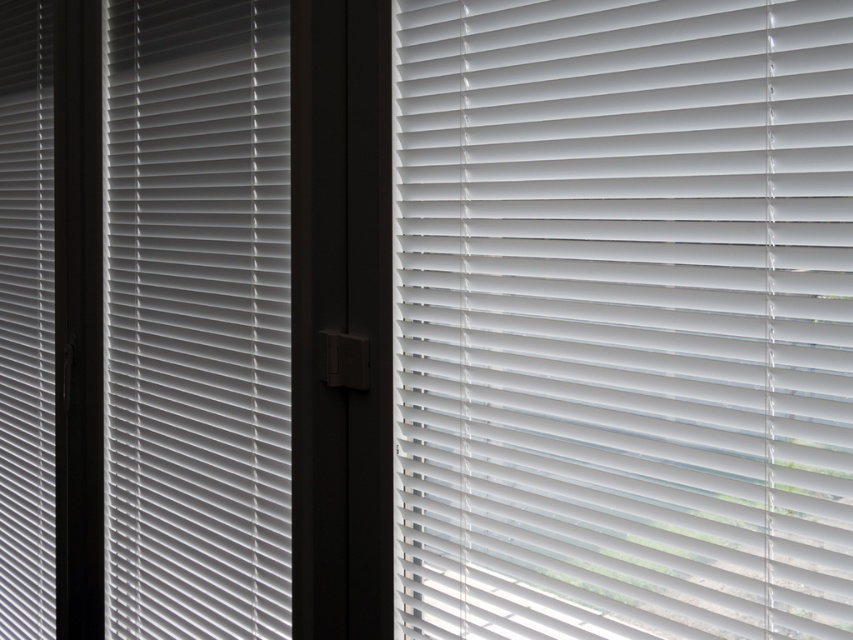
Is white plastic blinds at right bigger than white plastic blinds at left?

Actually, white plastic blinds at right might be smaller than white plastic blinds at left.

Which is more to the right, white plastic blinds at right or white plastic blinds at left?

white plastic blinds at right is more to the right.

This screenshot has height=640, width=853. Describe the element at coordinates (622, 317) in the screenshot. I see `white plastic blinds at right` at that location.

Locate an element on the screen. white plastic blinds at right is located at coordinates (622, 317).